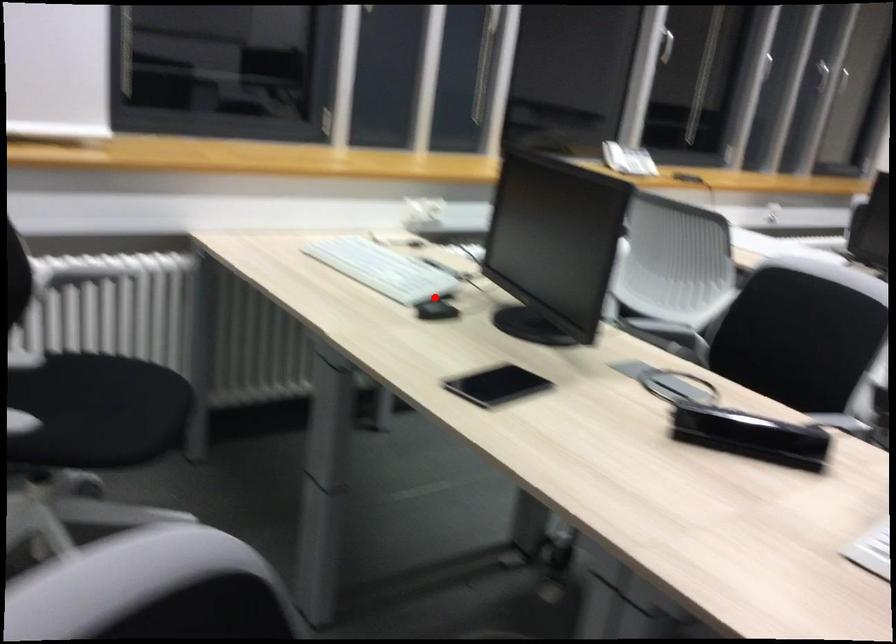
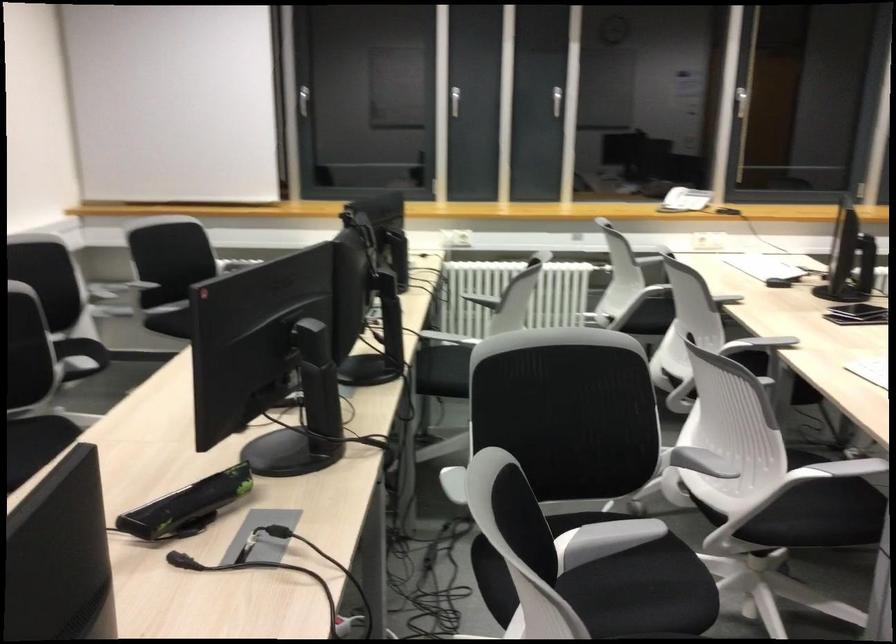
Question: I am providing you with two images of the same scene from different viewpoints. A red point is marked on the first image. At the location where the point appears in image 1, is it still visible in image 2?

Choices:
 (A) Yes
 (B) No

Answer: (B)